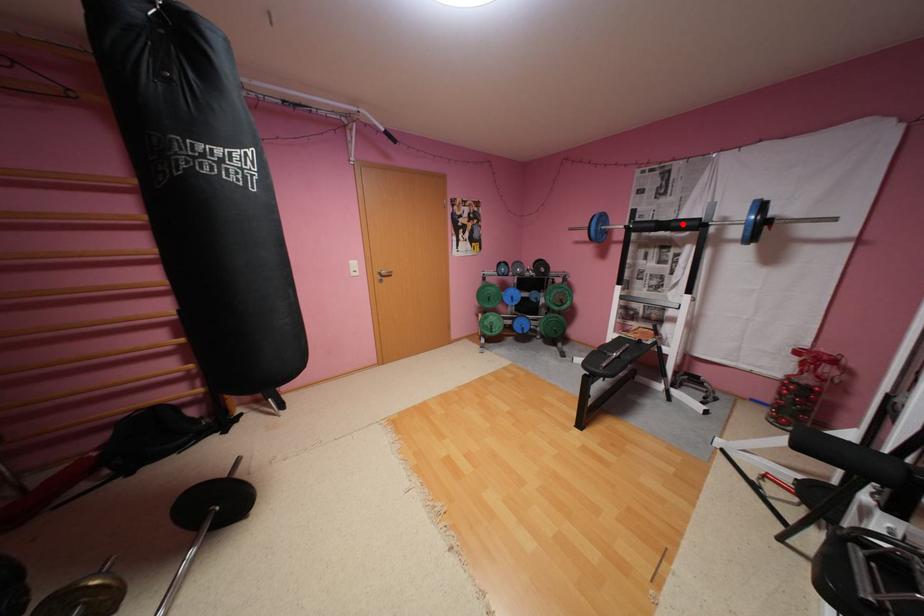
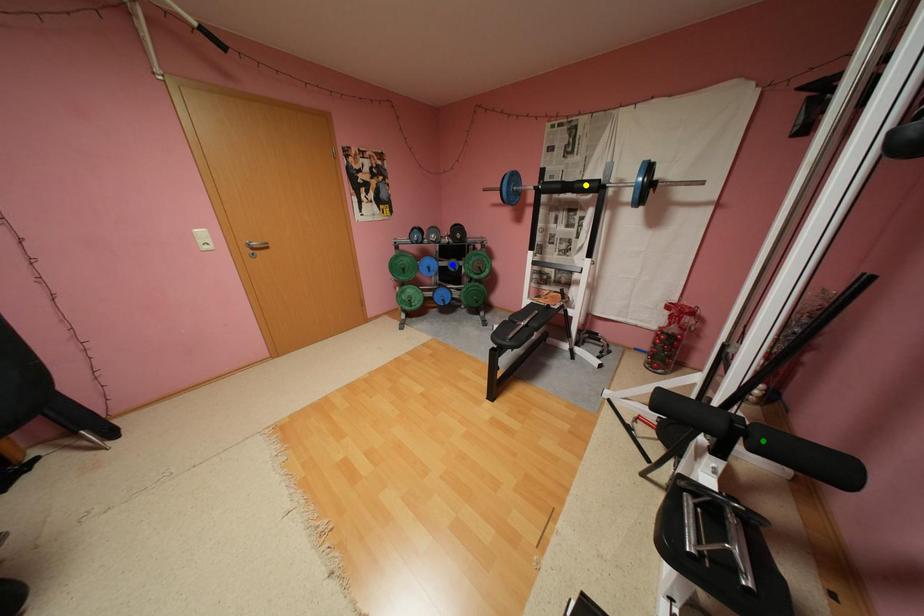
Question: I am providing you with two images of the same scene from different viewpoints. A red point is marked on the first image. You are given multiple points on the second image. Which point in image 2 is actually the same real-world point as the red point in image 1?

Choices:
 (A) green point
 (B) blue point
 (C) yellow point

Answer: (C)